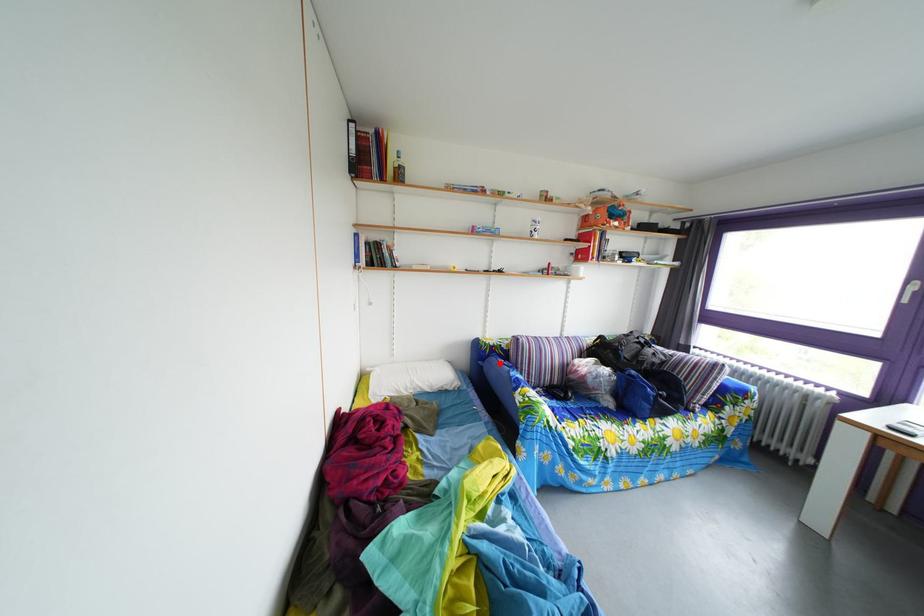
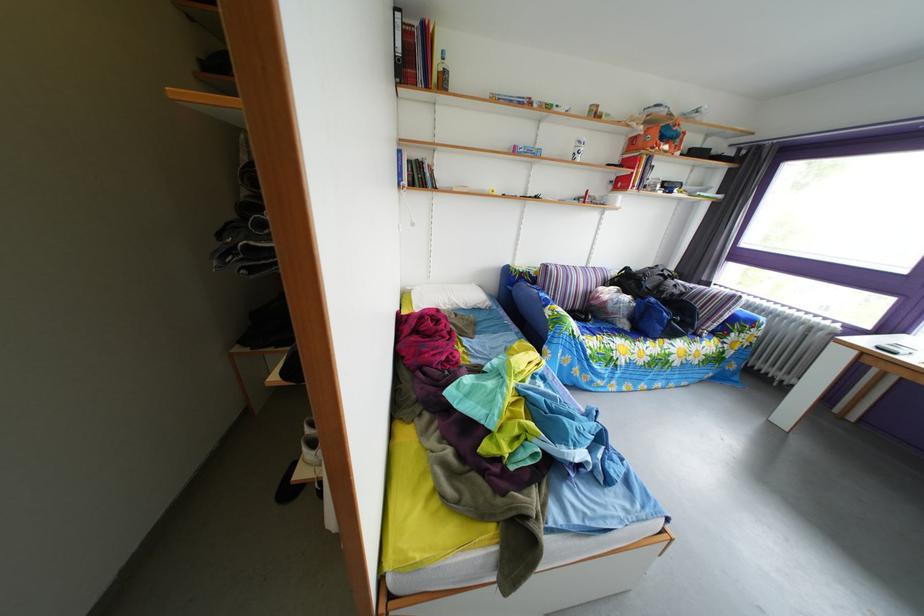
The point at the highlighted location is marked in the first image. Where is the corresponding point in the second image?

(529, 289)